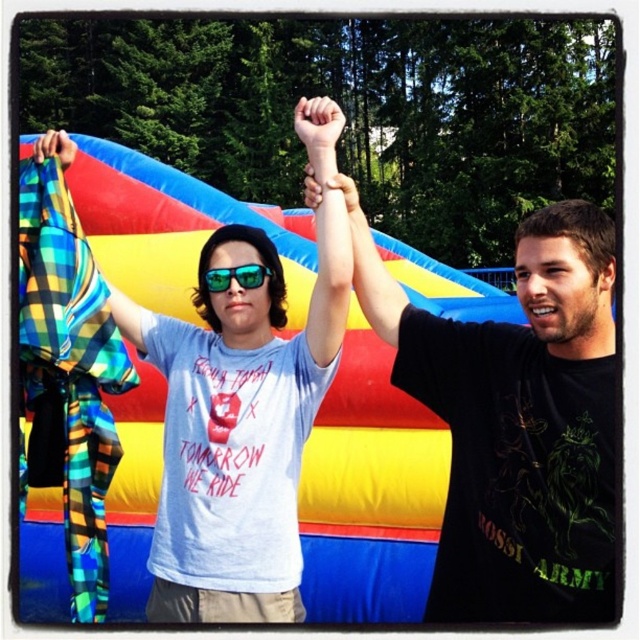
You are a photographer trying to capture a closeup shot of the green reflective sunglasses at center. However, the smooth skin hand at center is blocking your view. Can you estimate whether the hand is positioned higher or lower than the sunglasses?

The smooth skin hand at center is much taller than the green reflective sunglasses at center, so the hand is positioned higher and blocking the view.

You are a photographer trying to capture a closeup of the green reflective sunglasses at center. There is a smooth skin hand at center blocking your view. Can you tell me if the hand is to the left or right of the sunglasses?

The smooth skin hand at center is positioned on the right side of green reflective sunglasses at center, so the hand is to the right of the sunglasses.